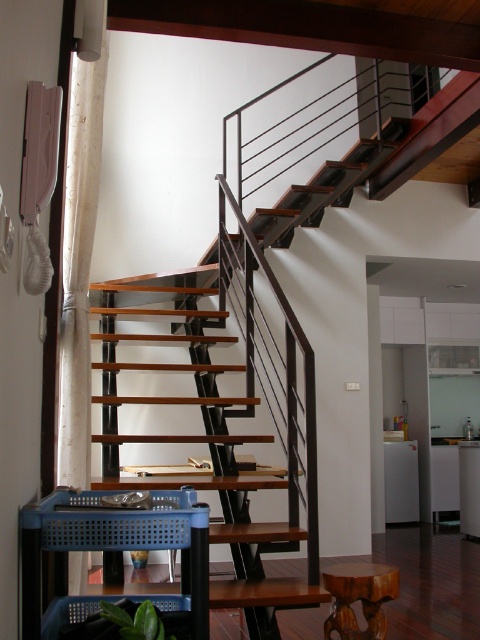
Between blue plastic basket at lower left and wooden stool at lower right, which one appears on the right side from the viewer's perspective?

wooden stool at lower right is more to the right.

Is point (197, 616) closer to viewer compared to point (331, 625)?

Yes.

Locate an element on the screen. The width and height of the screenshot is (480, 640). blue plastic basket at lower left is located at coordinates tap(111, 548).